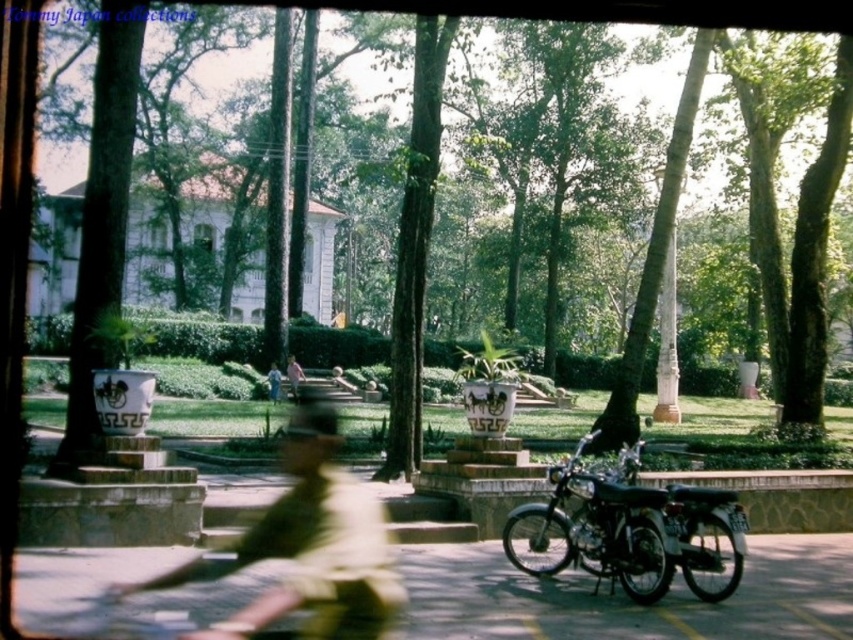
Question: Does shiny chrome motorcycle at center have a lesser width compared to blue fabric person at center?

Choices:
 (A) yes
 (B) no

Answer: (B)

Question: Based on their relative distances, which object is farther from the camouflage uniform at center?

Choices:
 (A) pink fabric dress at center
 (B) shiny chrome motorcycle at center

Answer: (A)

Question: Which object appears farthest from the camera in this image?

Choices:
 (A) camouflage uniform at center
 (B) shiny chrome motorcycle at center
 (C) green leafy tree at center

Answer: (B)

Question: Does shiny chrome motorcycle at center have a lesser width compared to pink fabric dress at center?

Choices:
 (A) yes
 (B) no

Answer: (B)

Question: From the image, what is the correct spatial relationship of green leafy tree at center in relation to blue fabric person at center?

Choices:
 (A) above
 (B) below

Answer: (A)

Question: Which point appears closest to the camera in this image?

Choices:
 (A) (306, 536)
 (B) (296, 388)
 (C) (273, 385)

Answer: (A)